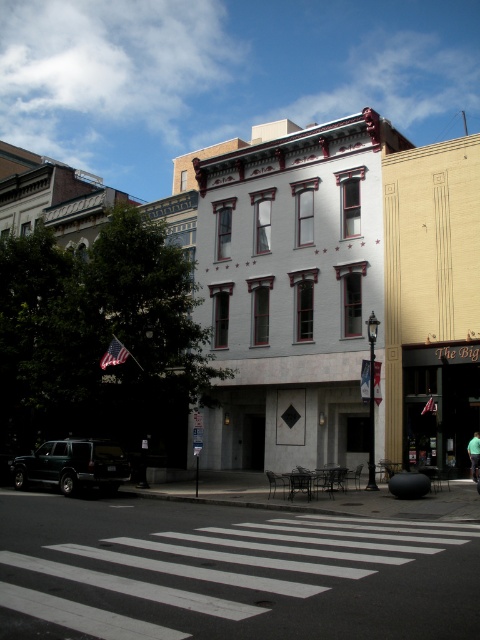
Based on the photo, does white painted crosswalk at lower center have a larger size compared to dark green matte suv at lower left?

Yes, white painted crosswalk at lower center is bigger than dark green matte suv at lower left.

Is point (136, 579) positioned before point (61, 470)?

Yes.

What do you see at coordinates (228, 572) in the screenshot? The height and width of the screenshot is (640, 480). I see `white painted crosswalk at lower center` at bounding box center [228, 572].

The image size is (480, 640). In order to click on white painted crosswalk at lower center in this screenshot , I will do `click(228, 572)`.